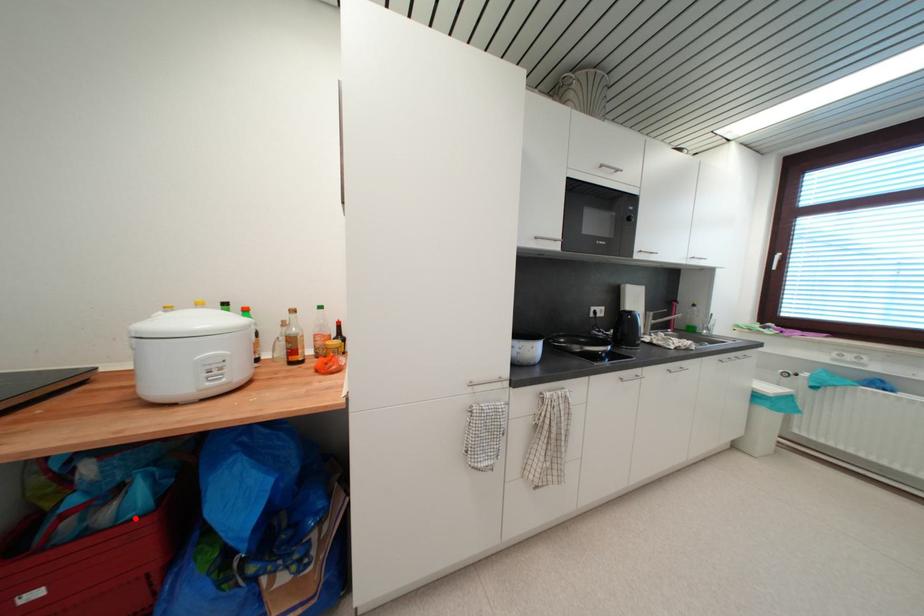
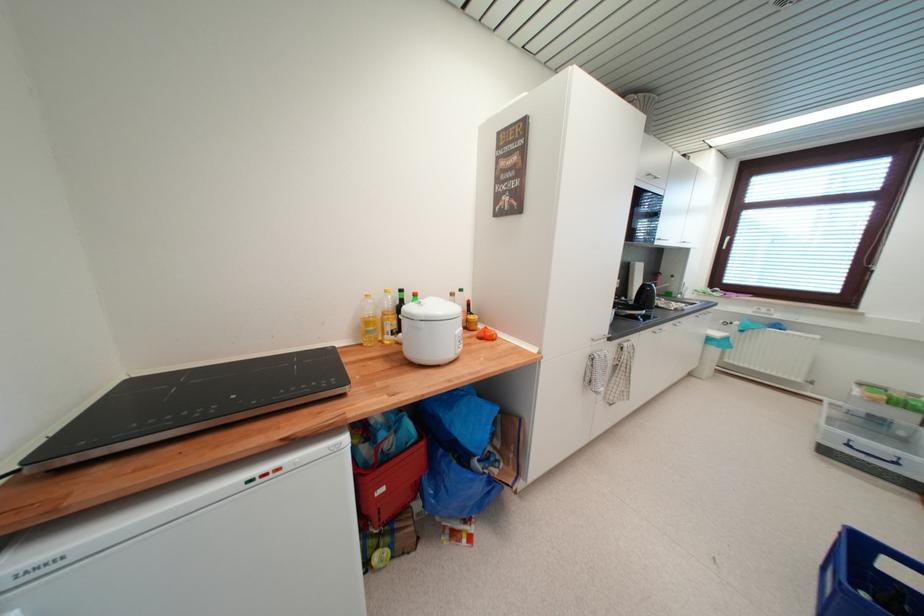
Question: I am providing you with two images of the same scene from different viewpoints. Given a red point in image1, look at the same physical point in image2. Is it:

Choices:
 (A) Closer to the viewpoint
 (B) Farther from the viewpoint

Answer: (B)